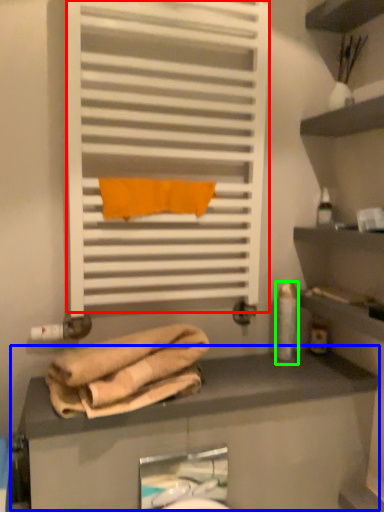
Question: Estimate the real-world distances between objects in this image. Which object is closer to shutter (highlighted by a red box), counter (highlighted by a blue box) or toiletry (highlighted by a green box)?

Choices:
 (A) counter
 (B) toiletry

Answer: (B)